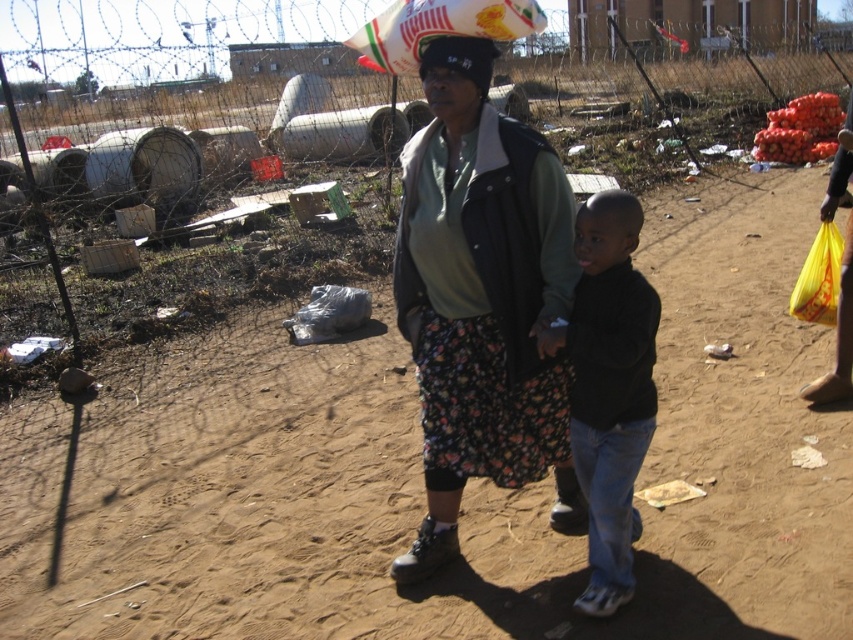
Who is lower down, floral fabric skirt at center or smooth black hair at center?

floral fabric skirt at center is below.

Does floral fabric skirt at center have a greater height compared to smooth black hair at center?

Yes.

Which is in front, point (486, 236) or point (621, 234)?

Point (621, 234)

Locate an element on the screen. This screenshot has height=640, width=853. floral fabric skirt at center is located at coordinates (480, 298).

I want to click on floral fabric skirt at center, so click(x=480, y=298).

Where is `floral fabric skirt at center`? floral fabric skirt at center is located at coordinates (480, 298).

Locate an element on the screen. floral fabric skirt at center is located at coordinates (480, 298).

Measure the distance between black matte shirt at center and smooth black hair at center.

The distance of black matte shirt at center from smooth black hair at center is 17.26 inches.

Is point (619, 452) positioned after point (614, 250)?

Yes, point (619, 452) is behind point (614, 250).

Image resolution: width=853 pixels, height=640 pixels. In order to click on black matte shirt at center in this screenshot , I will do `click(608, 388)`.